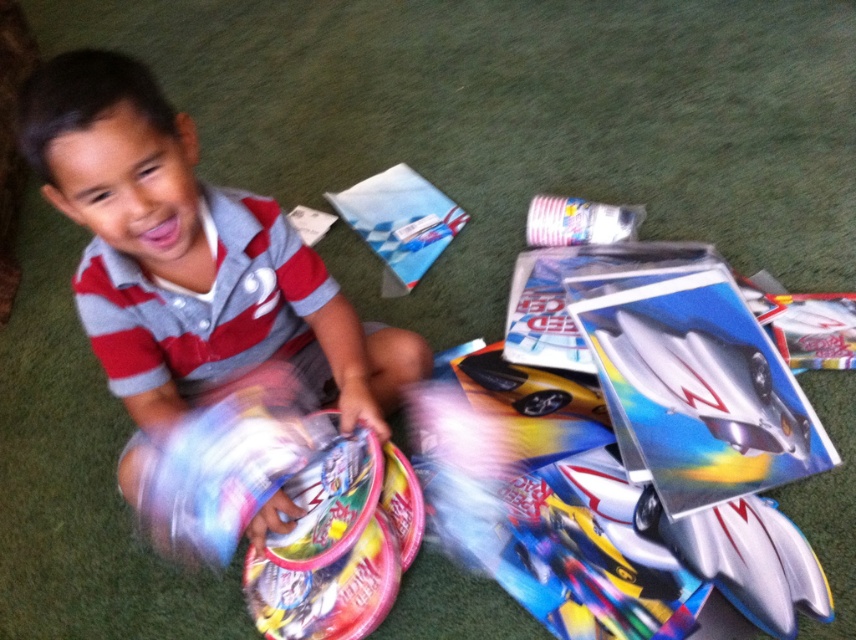
You are a delivery robot with a 20 cm wide arm. You need to place a package between the matte gray shirt at center and the glossy plastic toy at lower left. Can your arm fit in the space between them?

The distance between the matte gray shirt at center and the glossy plastic toy at lower left is 24.07 centimeters, so yes, the robot arm can fit since it is narrower than the space.